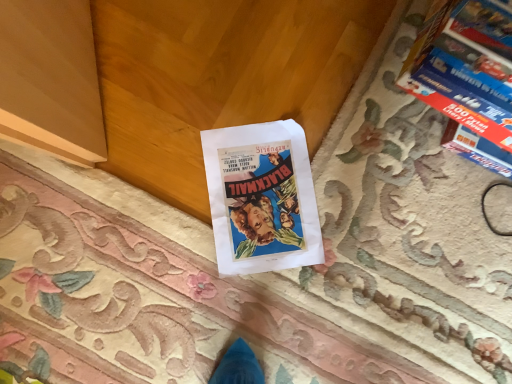
Question: Is blue glossy book at upper right spatially inside vintage paper poster at center, or outside of it?

Choices:
 (A) outside
 (B) inside

Answer: (A)

Question: Looking at their shapes, would you say blue glossy book at upper right is wider or thinner than vintage paper poster at center?

Choices:
 (A) wide
 (B) thin

Answer: (A)

Question: Is blue glossy book at upper right to the left or to the right of vintage paper poster at center in the image?

Choices:
 (A) right
 (B) left

Answer: (A)

Question: From the image's perspective, is vintage paper poster at center above or below blue glossy book at upper right?

Choices:
 (A) above
 (B) below

Answer: (B)

Question: Relative to blue glossy book at upper right, is vintage paper poster at center in front or behind?

Choices:
 (A) front
 (B) behind

Answer: (B)

Question: From their relative heights in the image, would you say vintage paper poster at center is taller or shorter than blue glossy book at upper right?

Choices:
 (A) short
 (B) tall

Answer: (A)

Question: From a real-world perspective, is vintage paper poster at center physically located above or below blue glossy book at upper right?

Choices:
 (A) above
 (B) below

Answer: (B)